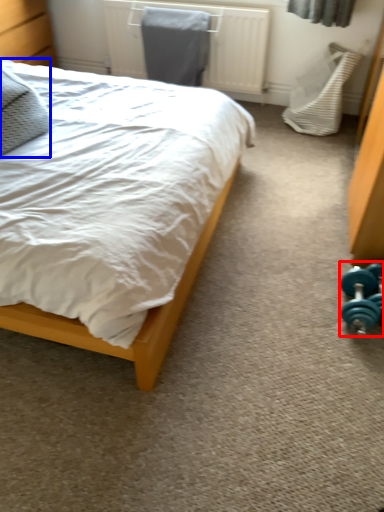
Question: Among these objects, which one is nearest to the camera, dumbbell (highlighted by a red box) or pillow (highlighted by a blue box)?

Choices:
 (A) dumbbell
 (B) pillow

Answer: (B)